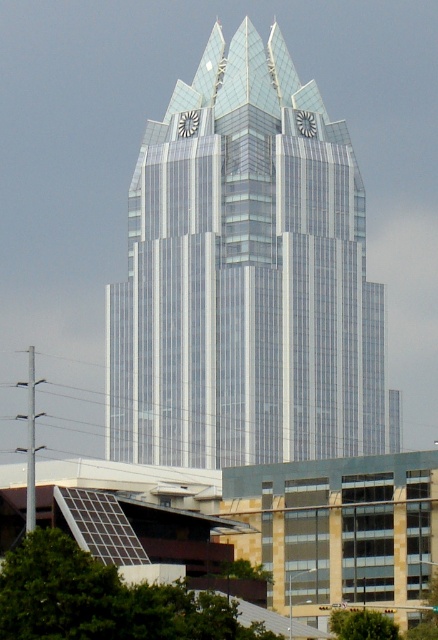
From the picture: You are a drone operator tasked with flying a drone from the transparent glass skyscraper at center to the green leafy tree at lower center. The drone has a maximum flight range of 500 feet. Can the drone complete the journey without needing to recharge?

The distance between the transparent glass skyscraper at center and the green leafy tree at lower center is 559.36 feet, which exceeds the drone maximum flight range of 500 feet. The drone cannot complete the journey without recharging.

You are standing in front of the modern skyscraper and looking at two points marked on the building. The first point is at coordinate point (229, 179) and the second is at point (387, 634). Which point is closer to your eyes?

Point (229, 179) is further to the camera than point (387, 634), so the point closer to your eyes is point (387, 634).